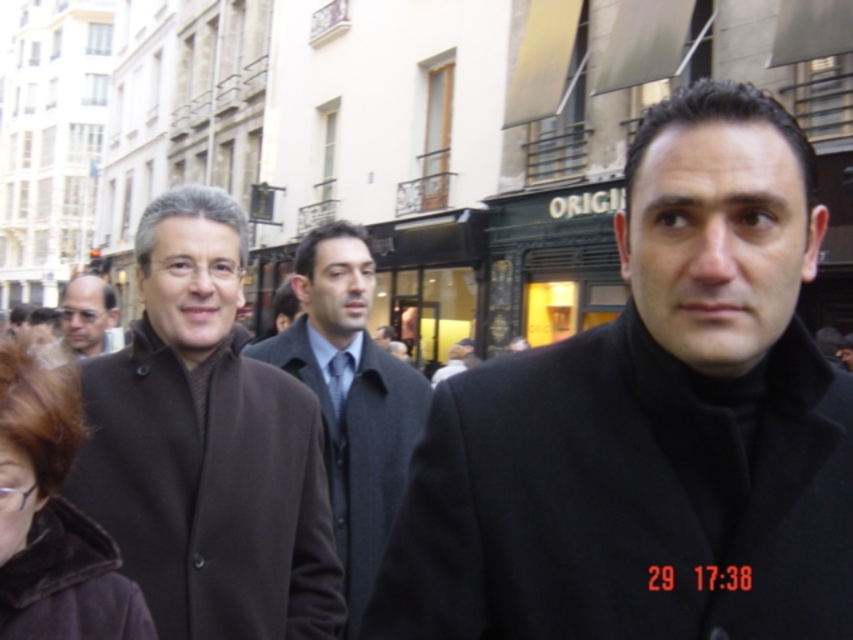
Between point (770, 353) and point (62, 323), which one is positioned behind?

The point (62, 323) is more distant.

Between black wool coat at center and matte black coat at left, which one is positioned lower?

black wool coat at center is lower down.

Is point (659, 188) more distant than point (73, 280)?

That is False.

Image resolution: width=853 pixels, height=640 pixels. I want to click on black wool coat at center, so click(x=651, y=422).

Does black wool coat at center have a smaller size compared to dark gray wool coat at center?

Yes.

Is point (665, 556) behind point (323, 416)?

No.

Describe the element at coordinates (651, 422) in the screenshot. I see `black wool coat at center` at that location.

Locate an element on the screen. This screenshot has height=640, width=853. black wool coat at center is located at coordinates (651, 422).

Consider the image. Is black wool coat at center positioned behind dark brown fur coat at lower left?

Yes.

Who is positioned more to the right, black wool coat at center or dark brown fur coat at lower left?

From the viewer's perspective, black wool coat at center appears more on the right side.

This screenshot has width=853, height=640. I want to click on black wool coat at center, so click(x=651, y=422).